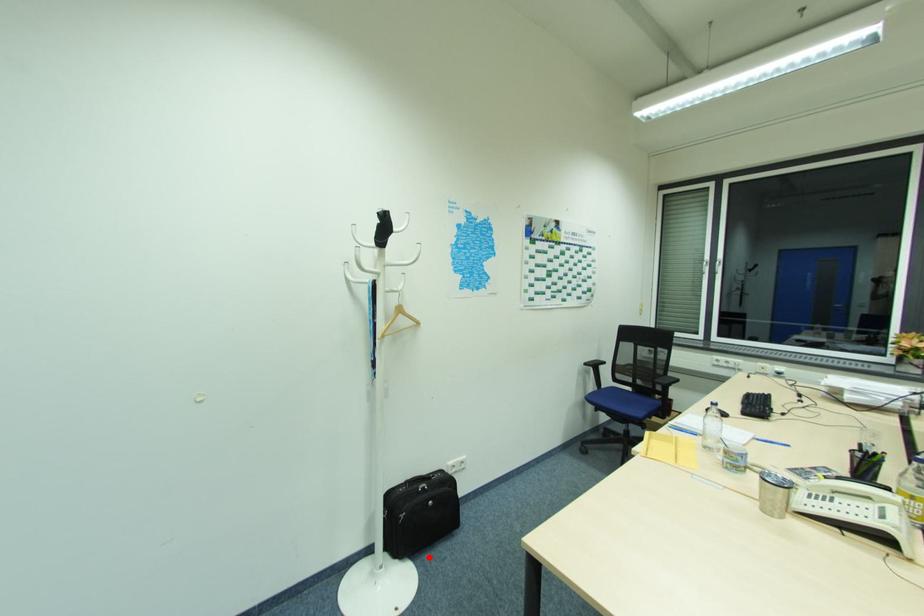
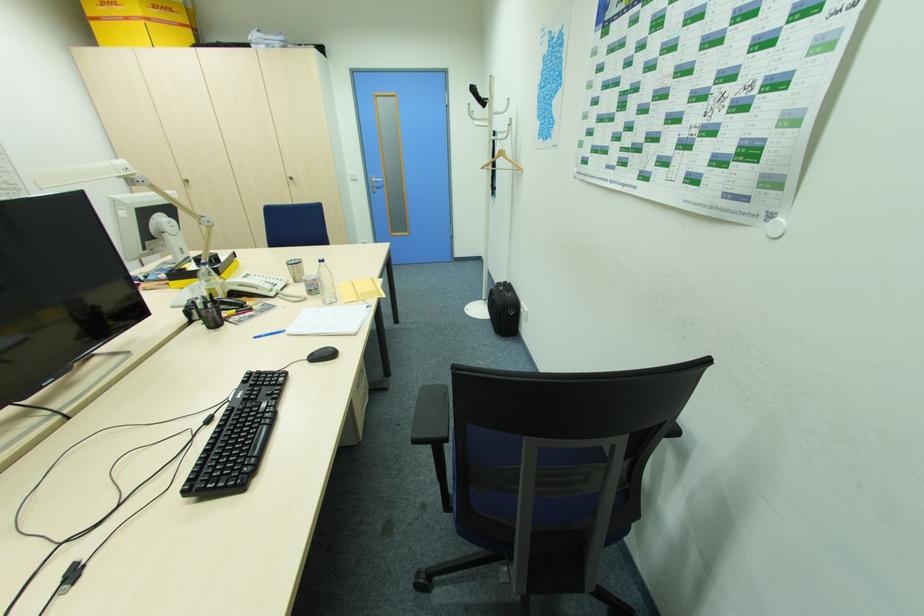
Question: I am providing you with two images of the same scene from different viewpoints. Given a red point in image1, look at the same physical point in image2. Is it:

Choices:
 (A) Closer to the viewpoint
 (B) Farther from the viewpoint

Answer: (A)